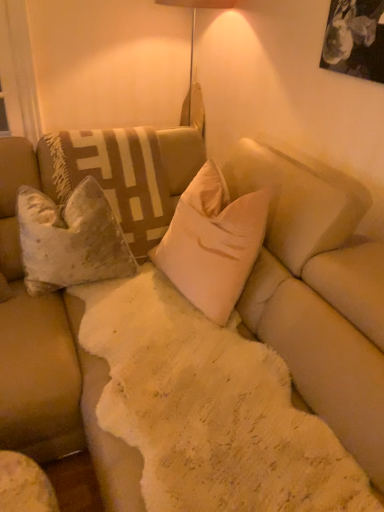
Describe the element at coordinates (212, 243) in the screenshot. I see `beige velvet pillow at center, the first pillow from the right` at that location.

Measure the distance between point (213,272) and camera.

The depth of point (213,272) is 4.81 feet.

Image resolution: width=384 pixels, height=512 pixels. What are the coordinates of `beige velvet pillow at center, placed as the second pillow when sorted from left to right` in the screenshot? It's located at (212, 243).

How much space does beige velvet pillow at center, placed as the second pillow when sorted from left to right, occupy horizontally?

9.79 inches.

Image resolution: width=384 pixels, height=512 pixels. Identify the location of velvet beige pillow at left, the first pillow positioned from the left. (71, 239).

What is the approximate width of velvet beige pillow at left, the first pillow positioned from the left?

velvet beige pillow at left, the first pillow positioned from the left, is 9.81 inches in width.

Describe the element at coordinates (71, 239) in the screenshot. I see `velvet beige pillow at left, the first pillow positioned from the left` at that location.

What are the coordinates of `beige velvet pillow at center, placed as the second pillow when sorted from left to right` in the screenshot? It's located at (212, 243).

Is beige velvet pillow at center, the first pillow from the right, to the left or to the right of velvet beige pillow at left, which is the second pillow from right to left, in the image?

beige velvet pillow at center, the first pillow from the right, is positioned on velvet beige pillow at left, which is the second pillow from right to left,'s right side.

Which is in front, beige velvet pillow at center, placed as the second pillow when sorted from left to right, or velvet beige pillow at left, the first pillow positioned from the left?

beige velvet pillow at center, placed as the second pillow when sorted from left to right, is in front.

Does point (180, 238) lie in front of point (41, 223)?

No, it is behind (41, 223).

From the image's perspective, is beige velvet pillow at center, placed as the second pillow when sorted from left to right, over velvet beige pillow at left, the first pillow positioned from the left?

No, from the image's perspective, beige velvet pillow at center, placed as the second pillow when sorted from left to right, is not on top of velvet beige pillow at left, the first pillow positioned from the left.

From a real-world perspective, is beige velvet pillow at center, placed as the second pillow when sorted from left to right, positioned under velvet beige pillow at left, which is the second pillow from right to left, based on gravity?

No, from a real-world perspective, beige velvet pillow at center, placed as the second pillow when sorted from left to right, is not below velvet beige pillow at left, which is the second pillow from right to left.

Is beige velvet pillow at center, the first pillow from the right, wider than velvet beige pillow at left, the first pillow positioned from the left?

No, beige velvet pillow at center, the first pillow from the right, is not wider than velvet beige pillow at left, the first pillow positioned from the left.

Is beige velvet pillow at center, placed as the second pillow when sorted from left to right, taller or shorter than velvet beige pillow at left, which is the second pillow from right to left?

In the image, beige velvet pillow at center, placed as the second pillow when sorted from left to right, appears to be taller than velvet beige pillow at left, which is the second pillow from right to left.

Looking at this image, does beige velvet pillow at center, placed as the second pillow when sorted from left to right, have a larger size compared to velvet beige pillow at left, which is the second pillow from right to left?

Indeed, beige velvet pillow at center, placed as the second pillow when sorted from left to right, has a larger size compared to velvet beige pillow at left, which is the second pillow from right to left.

Is velvet beige pillow at left, which is the second pillow from right to left, completely or partially inside beige velvet pillow at center, placed as the second pillow when sorted from left to right?

No, velvet beige pillow at left, which is the second pillow from right to left, is not a part of beige velvet pillow at center, placed as the second pillow when sorted from left to right.

Are beige velvet pillow at center, the first pillow from the right, and velvet beige pillow at left, which is the second pillow from right to left, far apart?

No.

Is beige velvet pillow at center, the first pillow from the right, facing towards velvet beige pillow at left, the first pillow positioned from the left?

Yes, beige velvet pillow at center, the first pillow from the right, is turned towards velvet beige pillow at left, the first pillow positioned from the left.

How different are the orientations of beige velvet pillow at center, placed as the second pillow when sorted from left to right, and velvet beige pillow at left, the first pillow positioned from the left, in degrees?

They differ by 74 degrees in their facing directions.

Identify the location of pillow located on the left of beige velvet pillow at center, the first pillow from the right. (71, 239).

Between velvet beige pillow at left, the first pillow positioned from the left, and beige velvet pillow at center, the first pillow from the right, which one appears on the right side from the viewer's perspective?

beige velvet pillow at center, the first pillow from the right, is more to the right.

Which is behind, velvet beige pillow at left, the first pillow positioned from the left, or beige velvet pillow at center, placed as the second pillow when sorted from left to right?

velvet beige pillow at left, the first pillow positioned from the left.

Which is less distant, [127,251] or [217,175]?

Point [127,251] is closer to the camera than point [217,175].

From the image's perspective, between velvet beige pillow at left, which is the second pillow from right to left, and beige velvet pillow at center, placed as the second pillow when sorted from left to right, which one is located above?

velvet beige pillow at left, which is the second pillow from right to left, appears higher in the image.

From a real-world perspective, is velvet beige pillow at left, which is the second pillow from right to left, located higher than beige velvet pillow at center, placed as the second pillow when sorted from left to right?

No, from a real-world perspective, velvet beige pillow at left, which is the second pillow from right to left, is not above beige velvet pillow at center, placed as the second pillow when sorted from left to right.

Is velvet beige pillow at left, which is the second pillow from right to left, thinner than beige velvet pillow at center, the first pillow from the right?

No, velvet beige pillow at left, which is the second pillow from right to left, is not thinner than beige velvet pillow at center, the first pillow from the right.

Which of these two, velvet beige pillow at left, the first pillow positioned from the left, or beige velvet pillow at center, placed as the second pillow when sorted from left to right, stands taller?

beige velvet pillow at center, placed as the second pillow when sorted from left to right, is taller.

In terms of size, does velvet beige pillow at left, which is the second pillow from right to left, appear bigger or smaller than beige velvet pillow at center, the first pillow from the right?

In the image, velvet beige pillow at left, which is the second pillow from right to left, appears to be smaller than beige velvet pillow at center, the first pillow from the right.

Is velvet beige pillow at left, which is the second pillow from right to left, outside of beige velvet pillow at center, the first pillow from the right?

velvet beige pillow at left, which is the second pillow from right to left, is positioned outside beige velvet pillow at center, the first pillow from the right.

Is velvet beige pillow at left, which is the second pillow from right to left, directly adjacent to beige velvet pillow at center, placed as the second pillow when sorted from left to right?

No, velvet beige pillow at left, which is the second pillow from right to left, is not touching beige velvet pillow at center, placed as the second pillow when sorted from left to right.

Is velvet beige pillow at left, the first pillow positioned from the left, positioned with its back to beige velvet pillow at center, the first pillow from the right?

velvet beige pillow at left, the first pillow positioned from the left, does not have its back to beige velvet pillow at center, the first pillow from the right.

How many degrees apart are the facing directions of velvet beige pillow at left, which is the second pillow from right to left, and beige velvet pillow at center, the first pillow from the right?

The angular difference between velvet beige pillow at left, which is the second pillow from right to left, and beige velvet pillow at center, the first pillow from the right, is 74 degrees.

Where is `pillow below the velvet beige pillow at left, the first pillow positioned from the left (from the image's perspective)`? The height and width of the screenshot is (512, 384). pillow below the velvet beige pillow at left, the first pillow positioned from the left (from the image's perspective) is located at coordinates pos(212,243).

At what (x,y) coordinates should I click in order to perform the action: click on pillow lying on the right of velvet beige pillow at left, the first pillow positioned from the left. Please return your answer as a coordinate pair (x, y). The height and width of the screenshot is (512, 384). Looking at the image, I should click on (212, 243).

Identify the location of pillow that is behind the beige velvet pillow at center, the first pillow from the right. The width and height of the screenshot is (384, 512). (71, 239).